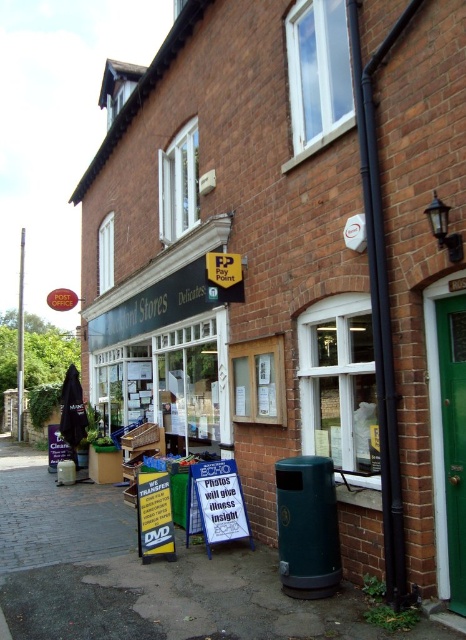
Is concrete pavement at lower left shorter than green metallic pole at left?

Indeed, concrete pavement at lower left has a lesser height compared to green metallic pole at left.

Locate an element on the screen. The image size is (466, 640). concrete pavement at lower left is located at coordinates (144, 576).

I want to click on concrete pavement at lower left, so click(x=144, y=576).

Is black plastic pipe at upper right to the right of green metallic pole at left from the viewer's perspective?

Yes, black plastic pipe at upper right is to the right of green metallic pole at left.

Does black plastic pipe at upper right have a lesser width compared to green metallic pole at left?

Yes, black plastic pipe at upper right is thinner than green metallic pole at left.

Does point (404, 595) come in front of point (21, 432)?

Yes, point (404, 595) is in front of point (21, 432).

Identify the location of black plastic pipe at upper right. This screenshot has width=466, height=640. (381, 301).

Who is taller, concrete pavement at lower left or black plastic pipe at upper right?

black plastic pipe at upper right

Can you confirm if concrete pavement at lower left is smaller than black plastic pipe at upper right?

Actually, concrete pavement at lower left might be larger than black plastic pipe at upper right.

Find the location of a particular element. concrete pavement at lower left is located at coordinates (144, 576).